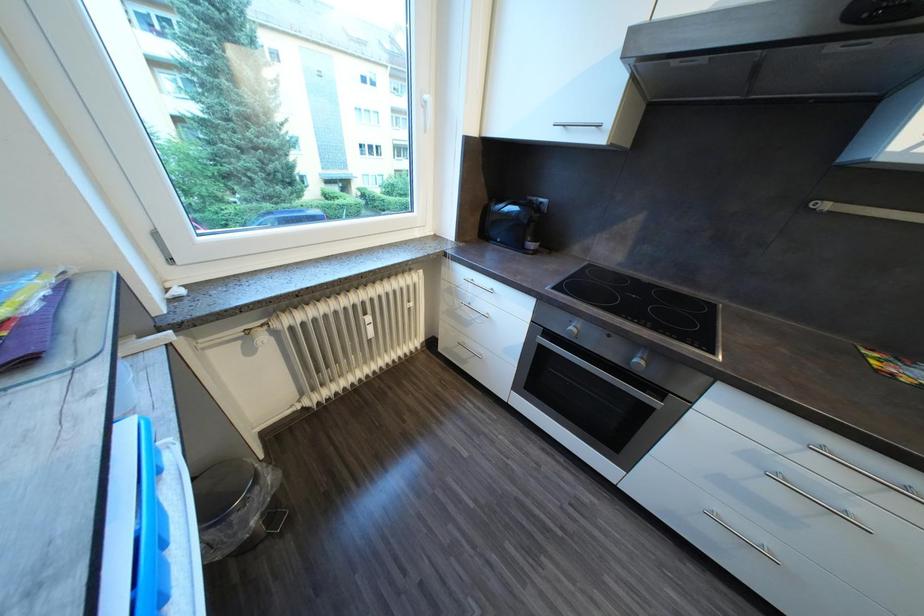
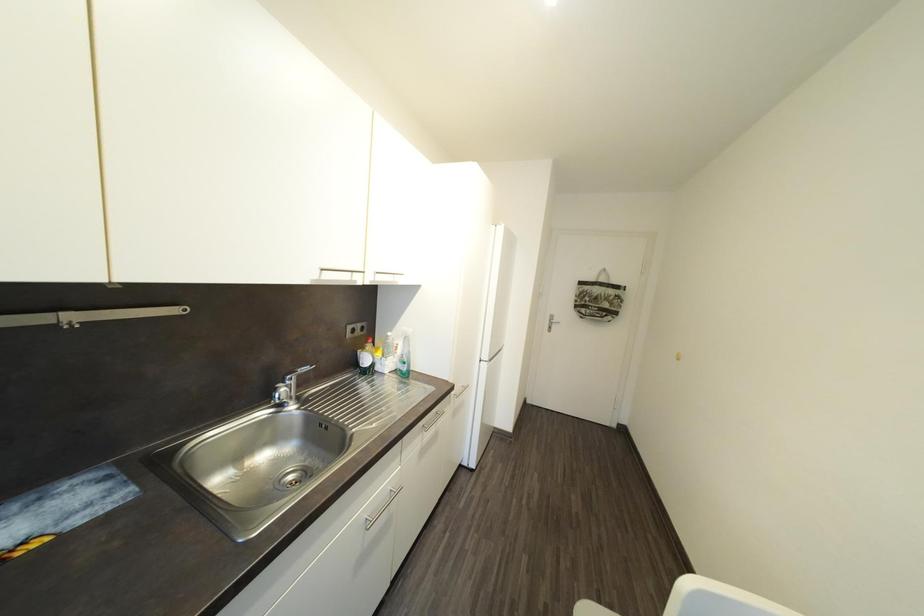
The first image is from the beginning of the video and the second image is from the end. How did the camera likely rotate when shooting the video?

The rotation direction of the camera is right-down.